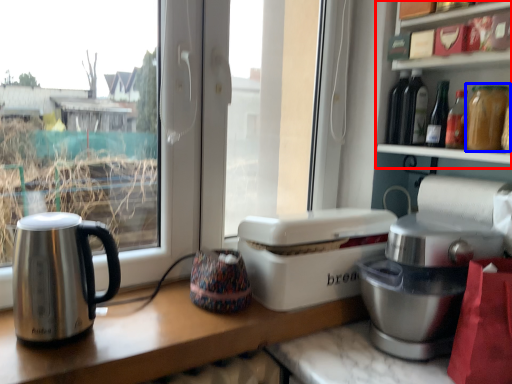
Question: Which object is closer to the camera taking this photo, shelf (highlighted by a red box) or bottle (highlighted by a blue box)?

Choices:
 (A) shelf
 (B) bottle

Answer: (A)